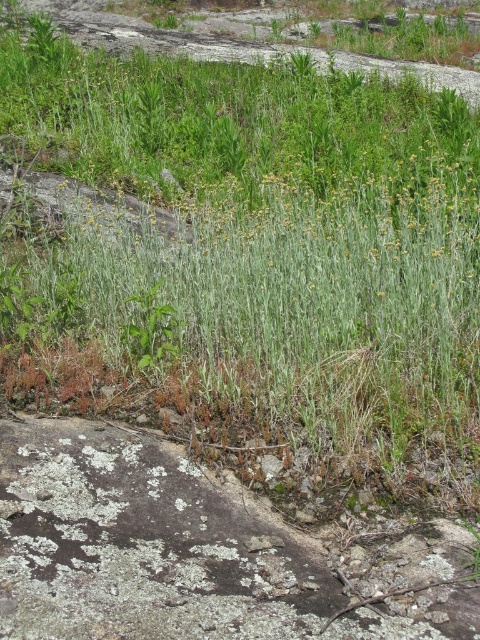
Question: Is green grass at center behind green leafy plant at center?

Choices:
 (A) yes
 (B) no

Answer: (B)

Question: Can you confirm if green grass at center is positioned above green leafy plant at center?

Choices:
 (A) no
 (B) yes

Answer: (B)

Question: Considering the relative positions of green grass at center and green leafy plant at center in the image provided, where is green grass at center located with respect to green leafy plant at center?

Choices:
 (A) left
 (B) right

Answer: (B)

Question: Which of the following is the farthest from the observer?

Choices:
 (A) green grass at center
 (B) green leafy plant at center

Answer: (B)